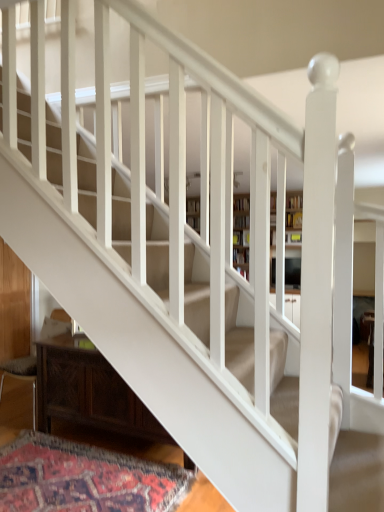
Question: Is wooden armchair at lower left positioned before carpeted mat at lower left?

Choices:
 (A) yes
 (B) no

Answer: (B)

Question: Can you confirm if wooden armchair at lower left is positioned to the right of carpeted mat at lower left?

Choices:
 (A) yes
 (B) no

Answer: (B)

Question: Considering the relative positions of wooden armchair at lower left and carpeted mat at lower left in the image provided, is wooden armchair at lower left to the left of carpeted mat at lower left from the viewer's perspective?

Choices:
 (A) no
 (B) yes

Answer: (B)

Question: Considering the relative sizes of wooden armchair at lower left and carpeted mat at lower left in the image provided, is wooden armchair at lower left shorter than carpeted mat at lower left?

Choices:
 (A) yes
 (B) no

Answer: (B)

Question: Can we say wooden armchair at lower left lies outside carpeted mat at lower left?

Choices:
 (A) no
 (B) yes

Answer: (B)

Question: Considering the positions of dark wood cabinet at lower left and wooden bookcase at center in the image, is dark wood cabinet at lower left bigger or smaller than wooden bookcase at center?

Choices:
 (A) big
 (B) small

Answer: (B)

Question: From the image's perspective, is dark wood cabinet at lower left positioned above or below wooden bookcase at center?

Choices:
 (A) above
 (B) below

Answer: (B)

Question: Which is correct: dark wood cabinet at lower left is inside wooden bookcase at center, or outside of it?

Choices:
 (A) inside
 (B) outside

Answer: (B)

Question: Is dark wood cabinet at lower left wider or thinner than wooden bookcase at center?

Choices:
 (A) wide
 (B) thin

Answer: (A)

Question: Is dark wood cabinet at lower left bigger or smaller than wooden armchair at lower left?

Choices:
 (A) small
 (B) big

Answer: (B)

Question: Is dark wood cabinet at lower left in front of or behind wooden armchair at lower left in the image?

Choices:
 (A) front
 (B) behind

Answer: (A)

Question: In terms of width, does dark wood cabinet at lower left look wider or thinner when compared to wooden armchair at lower left?

Choices:
 (A) wide
 (B) thin

Answer: (B)

Question: From the image's perspective, is dark wood cabinet at lower left located above or below wooden armchair at lower left?

Choices:
 (A) above
 (B) below

Answer: (B)

Question: From a real-world perspective, is wooden bookcase at center above or below carpeted mat at lower left?

Choices:
 (A) below
 (B) above

Answer: (B)

Question: From the image's perspective, is wooden bookcase at center above or below carpeted mat at lower left?

Choices:
 (A) above
 (B) below

Answer: (A)